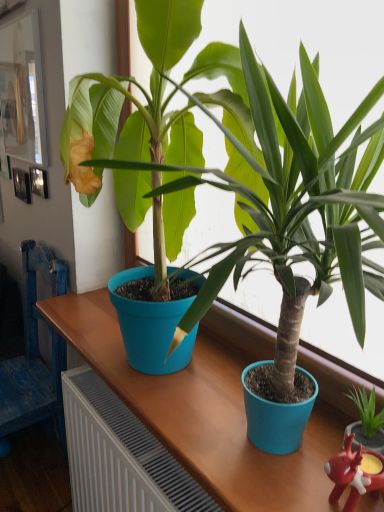
Question: Is white glossy picture frame at upper left taller or shorter than blue fabric chair at left?

Choices:
 (A) tall
 (B) short

Answer: (B)

Question: In terms of width, does white glossy picture frame at upper left look wider or thinner when compared to blue fabric chair at left?

Choices:
 (A) wide
 (B) thin

Answer: (B)

Question: Which object is positioned closest to the blue fabric chair at left?

Choices:
 (A) white glossy picture frame at upper left
 (B) rubberized red reindeer at lower right

Answer: (A)

Question: Which of these objects is positioned closest to the blue fabric chair at left?

Choices:
 (A) white glossy picture frame at upper left
 (B) rubberized red reindeer at lower right

Answer: (A)